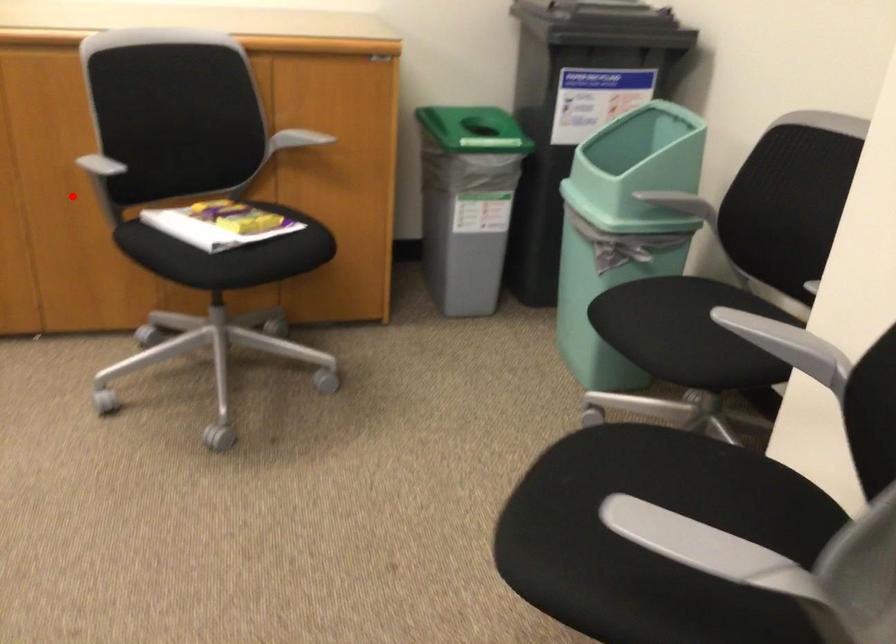
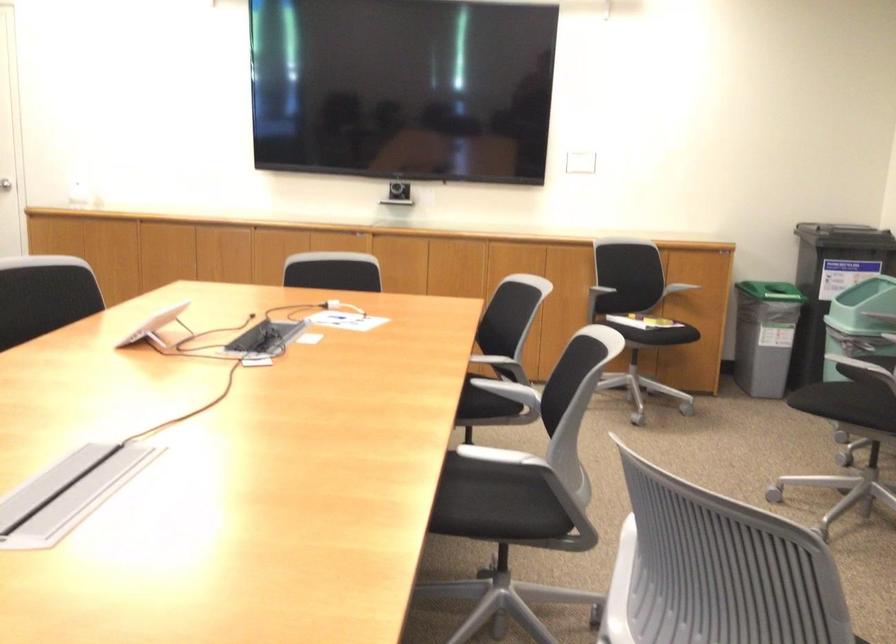
Where in the second image is the point corresponding to the highlighted location from the first image?

(571, 290)